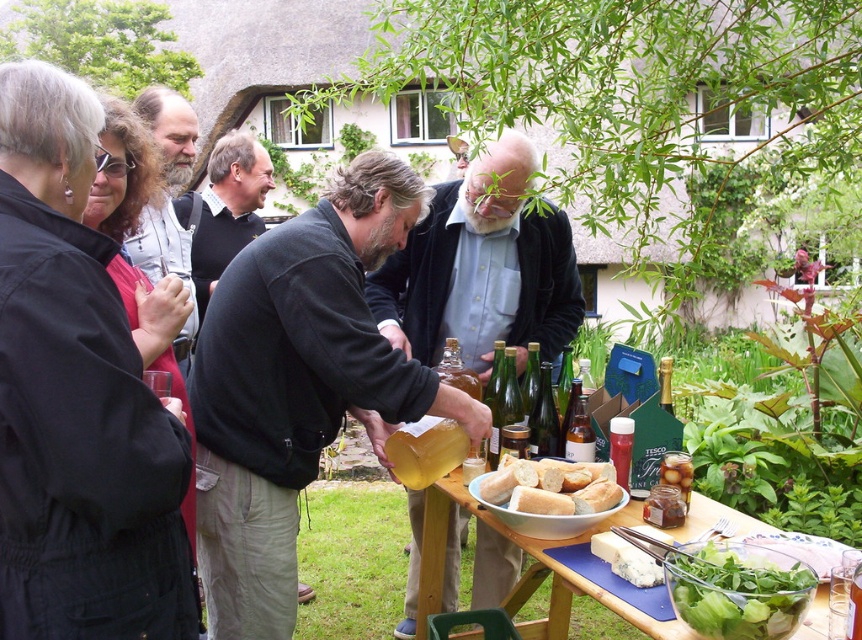
Is green leafy salad at lower right taller than black leather jacket at center?

No.

Between point (723, 584) and point (242, 156), which one is positioned in front?

Point (723, 584)

Find the location of a particular element. green leafy salad at lower right is located at coordinates (738, 589).

Who is positioned more to the left, white bread at center or matte black jacket at center?

matte black jacket at center is more to the left.

Is white bread at center below matte black jacket at center?

Indeed, white bread at center is positioned under matte black jacket at center.

This screenshot has width=862, height=640. What do you see at coordinates (553, 486) in the screenshot?
I see `white bread at center` at bounding box center [553, 486].

The width and height of the screenshot is (862, 640). I want to click on white bread at center, so click(x=553, y=486).

Between smooth brown leather jacket at center and white bread at center, which one has more height?

smooth brown leather jacket at center is taller.

Does point (411, 554) come farther from viewer compared to point (597, 484)?

Yes, it is.

The width and height of the screenshot is (862, 640). What are the coordinates of `smooth brown leather jacket at center` in the screenshot? It's located at (482, 268).